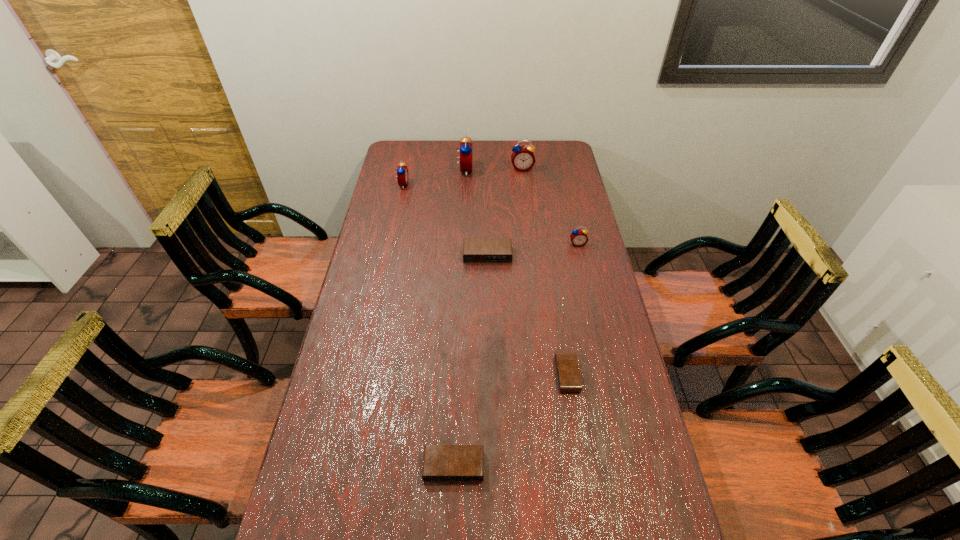
Find the location of a particular element. The image size is (960, 540). empty space between the fourth tallest object and the second red alarm clock from right to left is located at coordinates (550, 206).

The height and width of the screenshot is (540, 960). What are the coordinates of `empty space between the second red alarm clock from right to left and the leftmost red alarm clock` in the screenshot? It's located at (463, 177).

Find the location of a particular element. This screenshot has height=540, width=960. empty space that is in between the third smallest red alarm clock and the nearest alarm clock is located at coordinates (488, 317).

You are a GUI agent. You are given a task and a screenshot of the screen. Output one action in this format:
    pyautogui.click(x=<x>, y=<y>)
    Task: Click on the free space between the second tallest alarm clock and the second shortest alarm clock
    This screenshot has height=540, width=960.
    Given the screenshot: What is the action you would take?
    pyautogui.click(x=488, y=317)

You are a GUI agent. You are given a task and a screenshot of the screen. Output one action in this format:
    pyautogui.click(x=<x>, y=<y>)
    Task: Click on the free space between the second red alarm clock from left to right and the leftmost object
    
    Given the screenshot: What is the action you would take?
    pyautogui.click(x=433, y=177)

Find the location of a particular element. The width and height of the screenshot is (960, 540). empty location between the third farthest red alarm clock and the tallest alarm clock is located at coordinates (433, 177).

Find the location of `free area in between the nearest red alarm clock and the third smallest red alarm clock`. free area in between the nearest red alarm clock and the third smallest red alarm clock is located at coordinates (550, 206).

Identify the location of empty space that is in between the sixth shortest alarm clock and the second shortest alarm clock. (488, 317).

Where is `the second closest object to the tallest object`? This screenshot has height=540, width=960. the second closest object to the tallest object is located at coordinates (402, 171).

Choose which object is the fourth nearest neighbor to the nearest object. Please provide its 2D coordinates. Your answer should be formatted as a tuple, i.e. [(x, y)], where the tuple contains the x and y coordinates of a point satisfying the conditions above.

[(402, 171)]